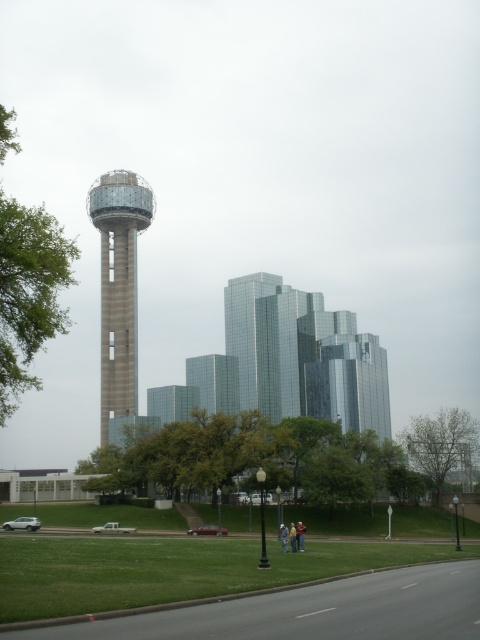
You are a gardener who needs to water the green grass at lower center and the green leafy tree at left. Your watering can holds enough water to cover 30 meters. If you start at the tree, can you reach the grass without refilling?

The distance between the green grass at lower center and the green leafy tree at left is 29.39 meters, which is less than the 30 meters your watering can can cover. Therefore, you can reach the grass without needing to refill.

You are a city planner looking at this cityscape. You need to determine which of the two green elements, the green grass at lower center or the green leafy tree at left, is shorter. Which one is shorter?

The green grass at lower center is shorter than the green leafy tree at left according to the description.

You are standing at the base of the observation tower on the left side of the cityscape. You want to walk to the green grass at lower center. Based on the coordinates provided, in which general direction should you head?

The green grass at lower center is located at coordinates point (175, 566). Since you are at the base of the observation tower on the left side, you should head towards the right and slightly downward to reach the green grass at lower center.